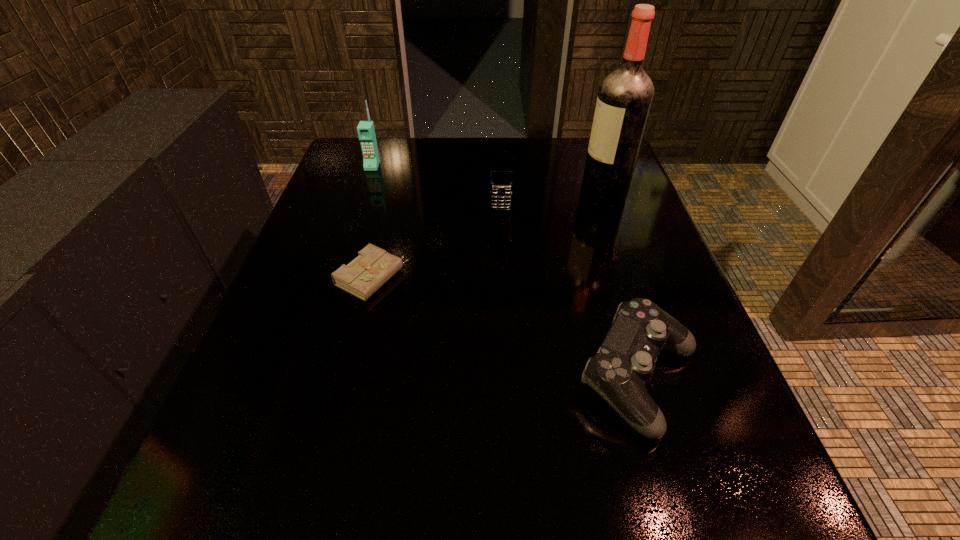
Where is `control present at the right edge`? The image size is (960, 540). control present at the right edge is located at coordinates (624, 363).

The width and height of the screenshot is (960, 540). Identify the location of object at the far left corner. (366, 132).

The height and width of the screenshot is (540, 960). In the image, there is a desktop. What are the coordinates of `vacant region at the far edge` in the screenshot? It's located at (404, 180).

In the image, there is a desktop. Where is `vacant space at the near edge`? vacant space at the near edge is located at coordinates (597, 524).

Identify the location of free point at the left edge. [290, 420].

The image size is (960, 540). In the image, there is a desktop. What are the coordinates of `vacant space at the right edge` in the screenshot? It's located at (648, 282).

Locate an element on the screen. The height and width of the screenshot is (540, 960). free space at the near left corner is located at coordinates (198, 504).

Identify the location of vacant area at the far right corner. (582, 144).

Where is `free space between the farthest object and the diary`? The image size is (960, 540). free space between the farthest object and the diary is located at coordinates (372, 222).

Identify the location of vacant region between the nearer cellular telephone and the liquor. The image size is (960, 540). (552, 202).